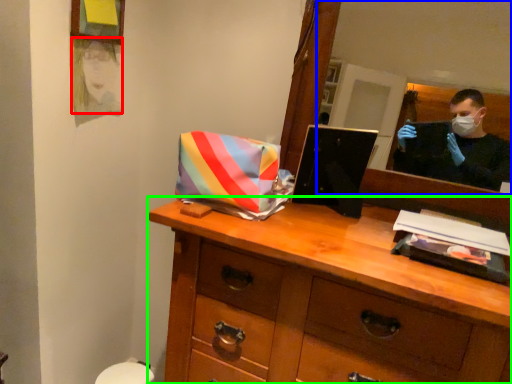
Question: Which object is positioned farthest from person (highlighted by a red box)? Select from mirror (highlighted by a blue box) and chest of drawers (highlighted by a green box).

Choices:
 (A) mirror
 (B) chest of drawers

Answer: (A)